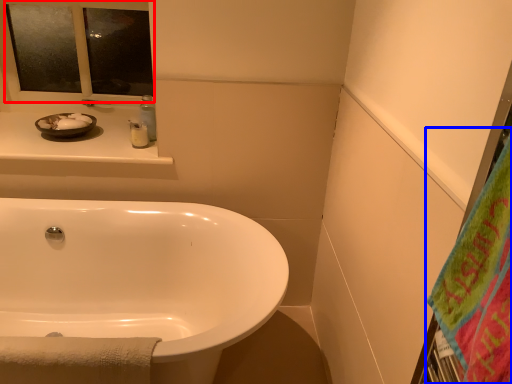
Question: Which of the following is the farthest to the observer, mirror (highlighted by a red box) or beach towel (highlighted by a blue box)?

Choices:
 (A) mirror
 (B) beach towel

Answer: (A)